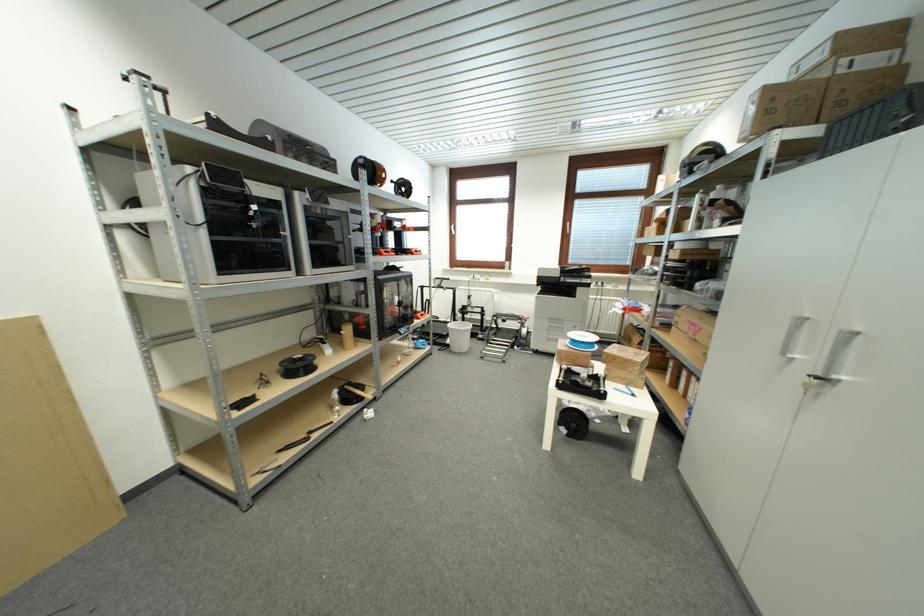
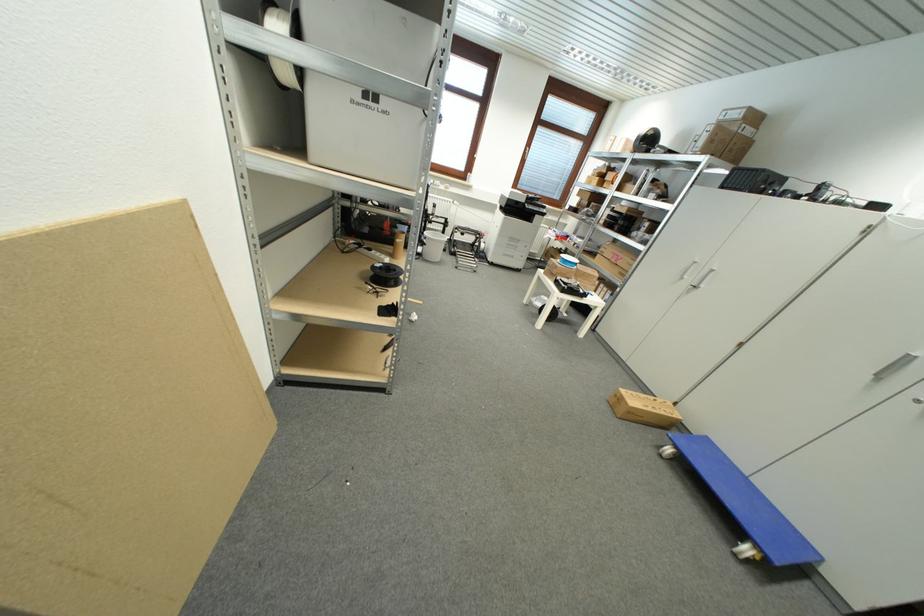
Find the pixel in the second image that matches (x=634, y=405) in the first image.

(599, 301)